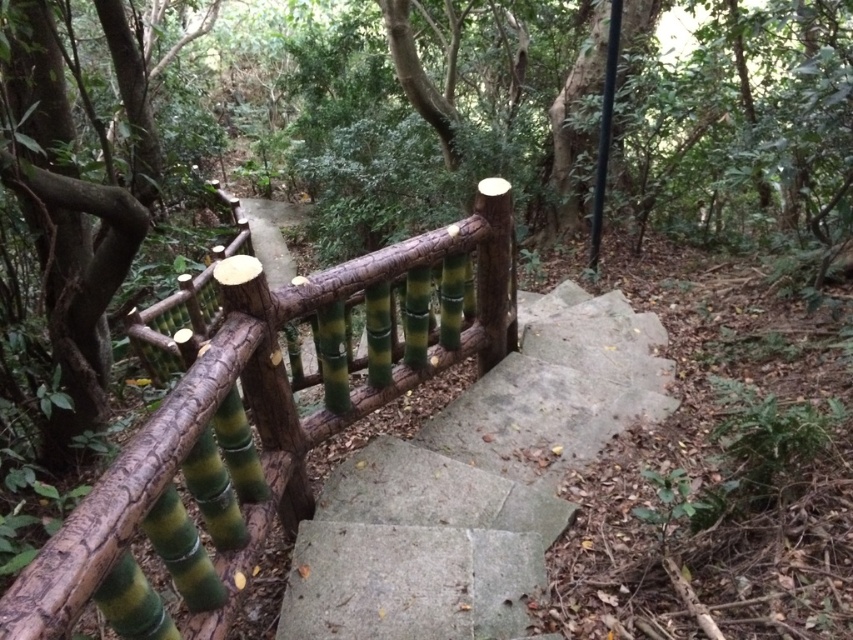
You are a hiker descending the smooth concrete stairs at center and need to hold onto the green bamboo railing at left for support. Is the railing within reach of your hand while holding the stairs?

The green bamboo railing at left is positioned over the smooth concrete stairs at center, so yes, it is within reach for support.

You are standing at the base of the stone steps in the forest. There is a green bamboo railing at left at point (264, 422). If you walk straight ahead towards the steps, will you encounter the green bamboo railing at left before reaching the first step?

The green bamboo railing at left is located at point (264, 422). Since the steps ascend from the base where you are standing, walking straight ahead would lead you directly toward the steps. The railing is positioned to the left, so it would not be in your direct path. Therefore, you would reach the first step before encountering the green bamboo railing at left.

You are a hiker navigating the forest path. You need to locate the smooth concrete stairs at center. Which direction should you move relative to the green bamboo railing at left to reach them?

The smooth concrete stairs at center are to the right of the green bamboo railing at left, so you should move to the right of the green bamboo railing at left to reach them.